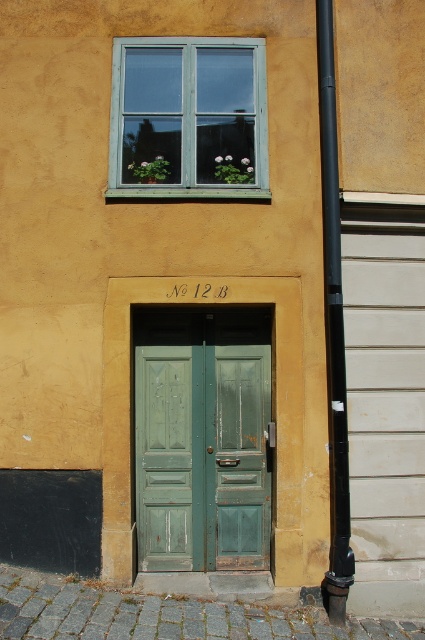
You are a delivery person trying to deliver a package to the address 12 B. You see the green matte door at center and the black matte pipe at right. Which object should you approach to enter the building?

You should approach the green matte door at center to enter the building since it is the entrance, while the black matte pipe at right is likely an obstruction or nonfunctional object.

You are standing in front of a building with a golden yellow wall. There is a window with a teal frame above a pair of green doors. A point at coordinates (x=201, y=438) is marked. Which object does this point correspond to?

The point at coordinates (x=201, y=438) corresponds to the green matte door at center.

You are a painter who needs to hang a picture frame that is 1.5 meters tall. You are standing in front of the building and looking at the green matte door at center and the teal wooden window at upper center. Which object can the frame fit vertically without exceeding its height?

The green matte door at center has a greater height compared to the teal wooden window at upper center, so the picture frame can be hung vertically on the green matte door at center since it is taller than the frame.